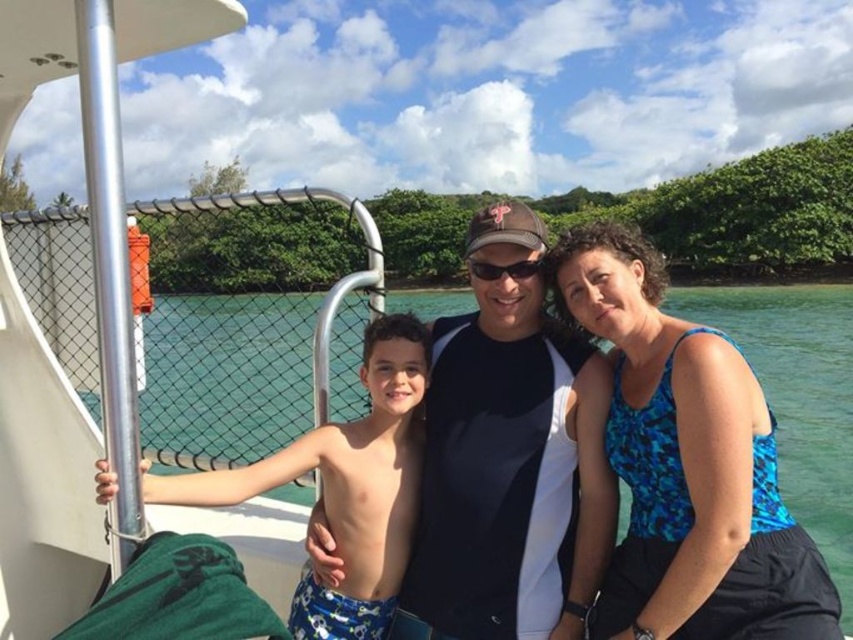
You are a photographer trying to capture a clear shot of the blue printed tank top at center and the blue printed swim trunks at left. Which clothing item appears smaller in the photo?

The blue printed tank top at center appears smaller than the blue printed swim trunks at left in the photo.

You are a photographer holding a camera that requires you to be at least 2 meters away from the subject to focus properly. You are taking a photo of the blue printed tank top at center on the boat. Can you focus on it with your current position?

The distance between you and the blue printed tank top at center is 2.05 meters, which is just over the minimum required 2 meters. Therefore, you can focus on the blue printed tank top at center with your current position.

You are a photographer trying to capture a group photo of the blue printed tank top at center and the blue printed swim trunks at left. The camera you are using has a minimum focus distance of 36 inches. Will both subjects be in focus?

The blue printed tank top at center and blue printed swim trunks at left are 36.57 inches apart. Since the distance between them is greater than the camera minimum focus distance of 36 inches, both subjects will be in focus.